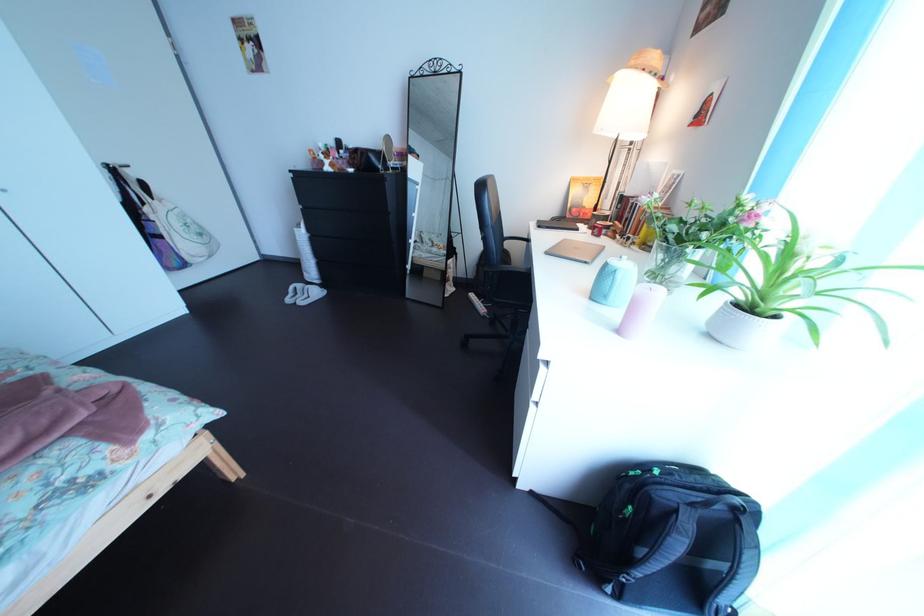
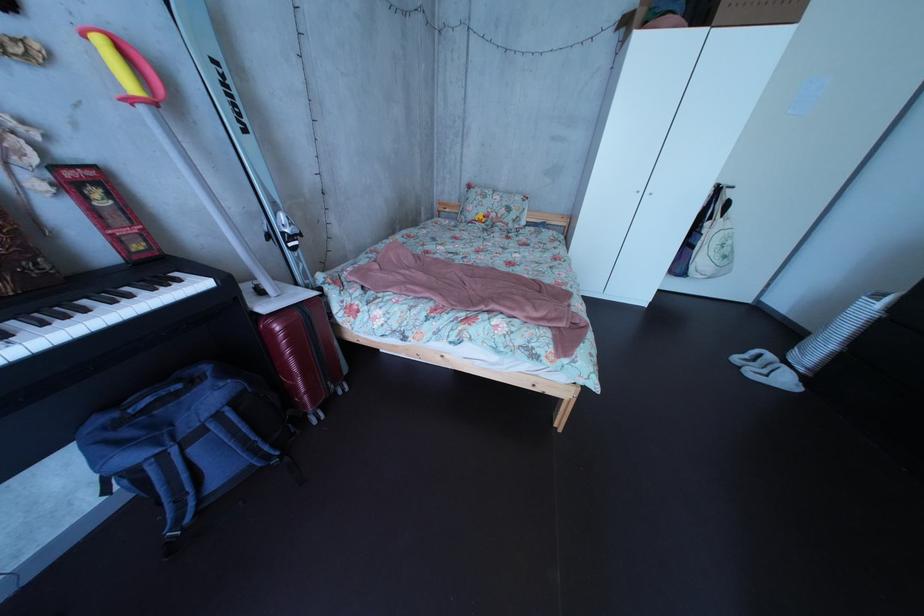
Where in the second image is the point corresponding to the point at 313,294 from the first image?

(784, 363)